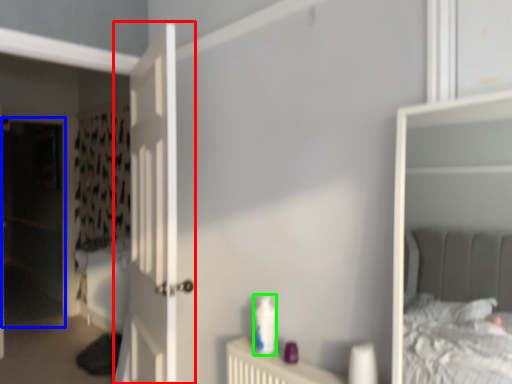
Question: Based on their relative distances, which object is nearer to door (highlighted by a red box)? Choose from screen door (highlighted by a blue box) and toiletry (highlighted by a green box).

Choices:
 (A) screen door
 (B) toiletry

Answer: (B)